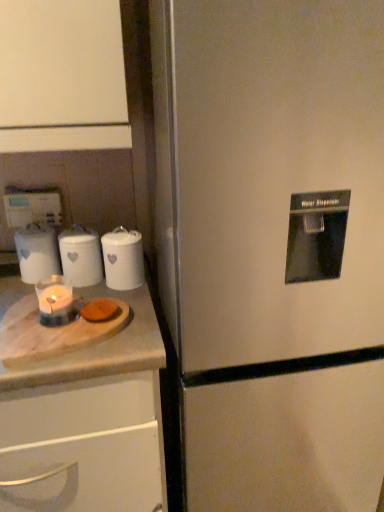
Locate an element on the screen. unoccupied region to the right of translucent glass candle at lower left is located at coordinates (133, 326).